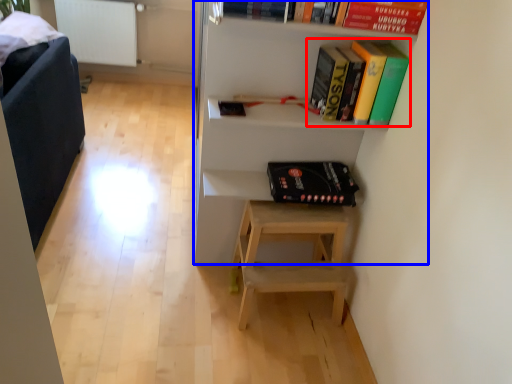
Question: Which point is further to the camera, book (highlighted by a red box) or shelf (highlighted by a blue box)?

Choices:
 (A) book
 (B) shelf

Answer: (A)